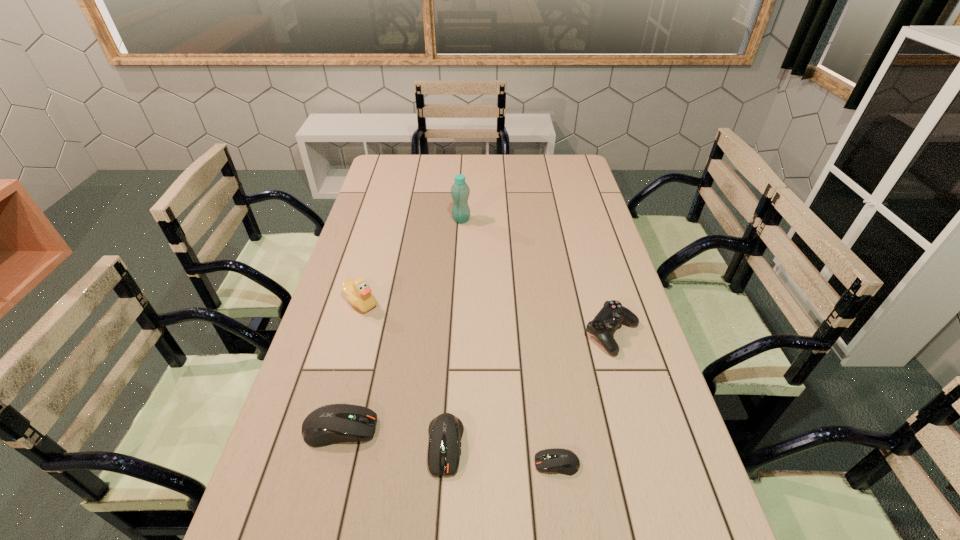
This screenshot has width=960, height=540. Find the location of `empty location between the control and the rightmost computer equipment`. empty location between the control and the rightmost computer equipment is located at coordinates (585, 399).

I want to click on vacant point located between the duck and the leftmost computer equipment, so click(350, 366).

Where is `unoccupied area between the second computer equipment from right to left and the control`? This screenshot has height=540, width=960. unoccupied area between the second computer equipment from right to left and the control is located at coordinates (529, 389).

The height and width of the screenshot is (540, 960). What are the coordinates of `vacant area that lies between the rightmost object and the second tallest computer equipment` in the screenshot? It's located at pyautogui.click(x=529, y=389).

You are a GUI agent. You are given a task and a screenshot of the screen. Output one action in this format:
    pyautogui.click(x=<x>, y=<y>)
    Task: Click on the object identified as the closest to the fifth object from left to right
    
    Given the screenshot: What is the action you would take?
    pyautogui.click(x=445, y=431)

Find the location of a particular element. the fifth closest object to the duck is located at coordinates (605, 323).

Where is `computer equipment that is the closest one to the second tallest object`? computer equipment that is the closest one to the second tallest object is located at coordinates (330, 424).

Locate which computer equipment is the second closest to the second object from right to left. Please provide its 2D coordinates. Your answer should be formatted as a tuple, i.e. [(x, y)], where the tuple contains the x and y coordinates of a point satisfying the conditions above.

[(330, 424)]

Identify the location of vacant region that satisfies the following two spatial constraints: 1. at the front cap of the tallest object; 2. at the beak of the fifth shortest object. This screenshot has height=540, width=960. (457, 302).

Locate an element on the screen. This screenshot has height=540, width=960. free space that satisfies the following two spatial constraints: 1. at the beak of the control; 2. on the right side of the second tallest object is located at coordinates (352, 334).